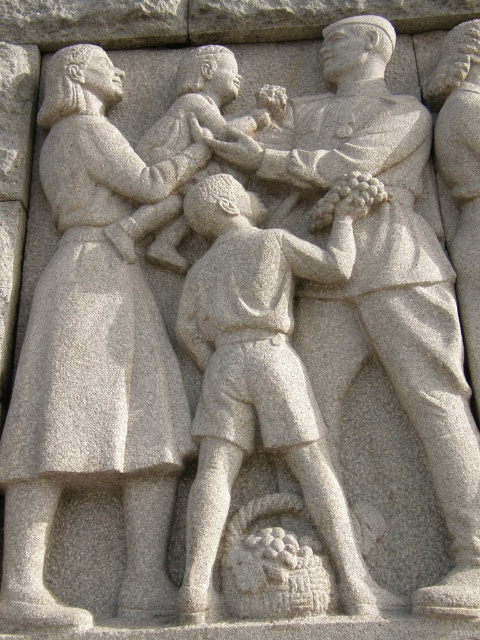
Question: Which point is closer to the camera taking this photo?

Choices:
 (A) (72, 371)
 (B) (300, 481)

Answer: (B)

Question: Can you confirm if granite statue of woman holding child at left is smaller than granite textured boy at center?

Choices:
 (A) yes
 (B) no

Answer: (B)

Question: Does granite statue of woman holding child at left have a greater width compared to granite textured boy at center?

Choices:
 (A) no
 (B) yes

Answer: (A)

Question: Which point appears closest to the camera in this image?

Choices:
 (A) (335, 531)
 (B) (4, 458)

Answer: (A)

Question: Which point is farther from the camera taking this photo?

Choices:
 (A) (210, 563)
 (B) (72, 97)

Answer: (B)

Question: Is granite statue of woman holding child at left to the right of granite textured boy at center from the viewer's perspective?

Choices:
 (A) no
 (B) yes

Answer: (A)